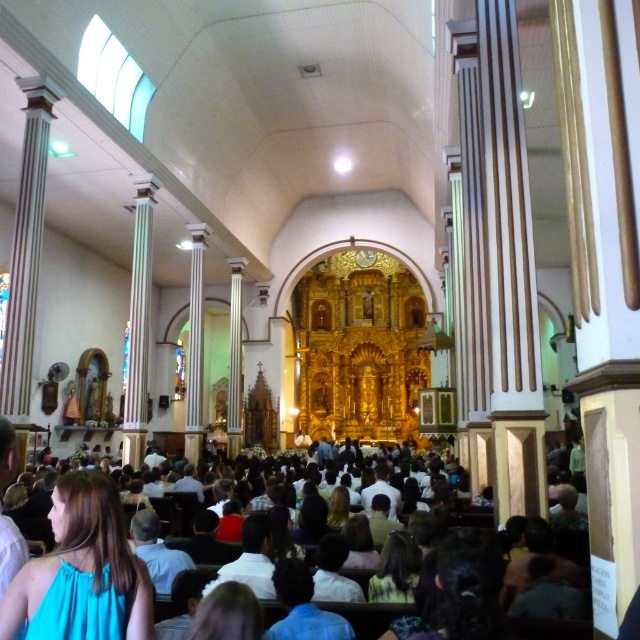
Who is positioned more to the right, white clothed crowd at center or teal fabric dress at lower left?

From the viewer's perspective, white clothed crowd at center appears more on the right side.

Locate an element on the screen. The height and width of the screenshot is (640, 640). white clothed crowd at center is located at coordinates (83, 572).

What are the coordinates of `white clothed crowd at center` in the screenshot? It's located at (83, 572).